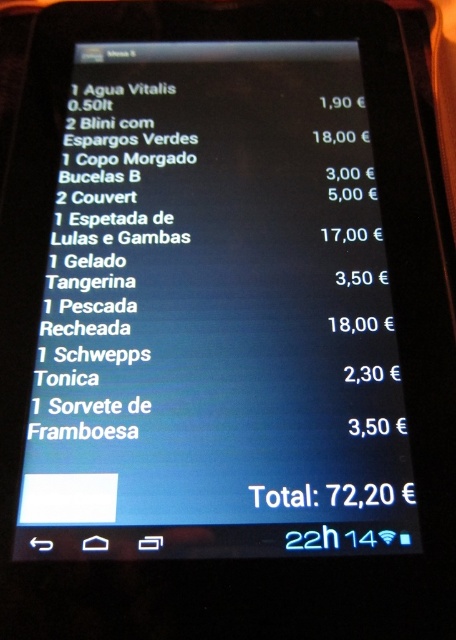
You are a customer looking at the black glossy tablet at center and the white paper menu at center on a table. Which item is placed higher on the table?

The white paper menu at center is placed higher than the black glossy tablet at center because the tablet is located below the menu.

You are a customer trying to place an order using the black glossy tablet at center and the white paper menu at center. Since you need to see both items clearly, which one should you hold higher to avoid blocking the view of the other?

The black glossy tablet at center is taller than the white paper menu at center, so you should hold the black glossy tablet at center higher to avoid blocking the view of the white paper menu at center.

What is located at the coordinates point (216,314) on the smartphone screen?

At point (216,314) lies the black glossy tablet at center.